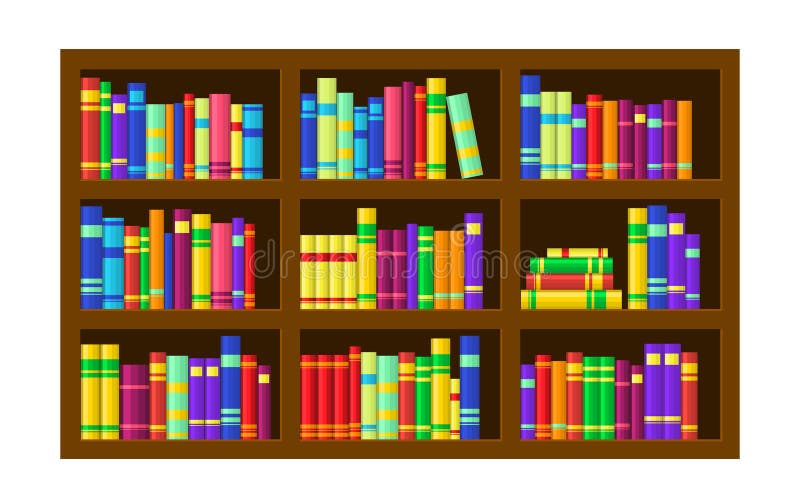
You are a GUI agent. You are given a task and a screenshot of the screen. Output one action in this format:
    pyautogui.click(x=<x>, y=<y>)
    Task: Click on the shelves
    The width and height of the screenshot is (800, 500).
    Given the screenshot: What is the action you would take?
    pyautogui.click(x=157, y=449), pyautogui.click(x=372, y=450), pyautogui.click(x=592, y=449), pyautogui.click(x=585, y=319), pyautogui.click(x=369, y=317), pyautogui.click(x=174, y=317), pyautogui.click(x=174, y=190), pyautogui.click(x=390, y=188), pyautogui.click(x=582, y=190)